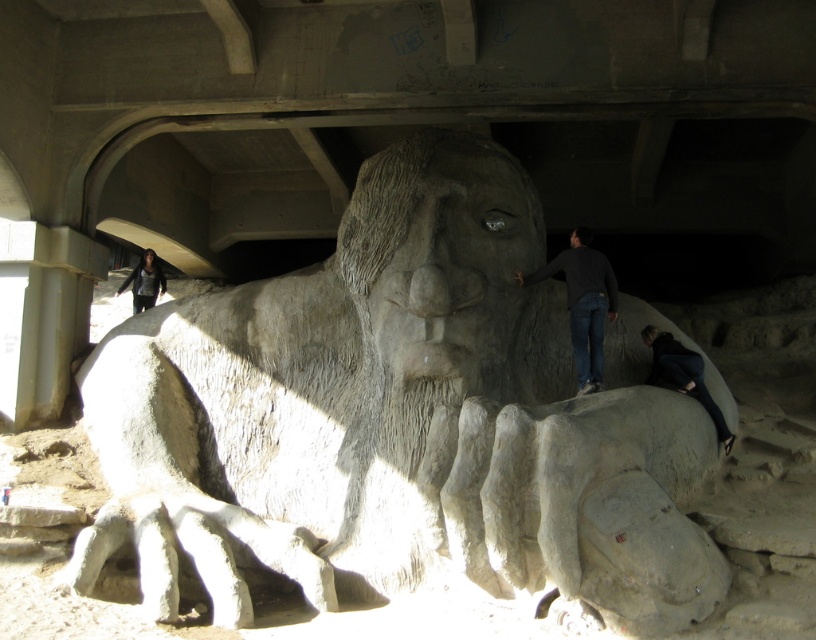
Who is higher up, dark gray sweater at upper right or dark gray sweater at lower left?

dark gray sweater at lower left is above.

Which is in front, point (570, 282) or point (132, 288)?

Point (570, 282) is in front.

Where is `dark gray sweater at upper right`? This screenshot has width=816, height=640. dark gray sweater at upper right is located at coordinates (583, 301).

Is dark gray sweater at upper right further to the viewer compared to black fabric pants at lower right?

No, dark gray sweater at upper right is closer to the viewer.

How much distance is there between dark gray sweater at upper right and black fabric pants at lower right?

The distance of dark gray sweater at upper right from black fabric pants at lower right is 5.27 feet.

Who is more distant from viewer, (x=583, y=305) or (x=714, y=419)?

Point (x=583, y=305)

Find the location of `dark gray sweater at upper right`. dark gray sweater at upper right is located at coordinates tap(583, 301).

Consider the image. Who is lower down, gray stone statue at center or dark gray sweater at lower left?

gray stone statue at center

Is point (564, 456) positioned in front of point (158, 294)?

Yes, it is.

This screenshot has width=816, height=640. Find the location of `gray stone statue at center`. gray stone statue at center is located at coordinates (400, 420).